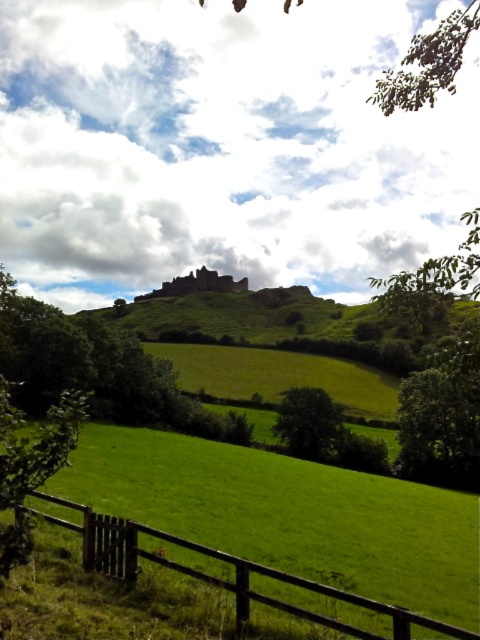
Which is more to the right, brown wooden fence at lower left or green leafy tree at center?

green leafy tree at center is more to the right.

Which is in front, point (90, 557) or point (295, 401)?

Positioned in front is point (90, 557).

Identify the location of brown wooden fence at lower left. (222, 572).

Find the location of a particular element. The height and width of the screenshot is (640, 480). brown wooden fence at lower left is located at coordinates (222, 572).